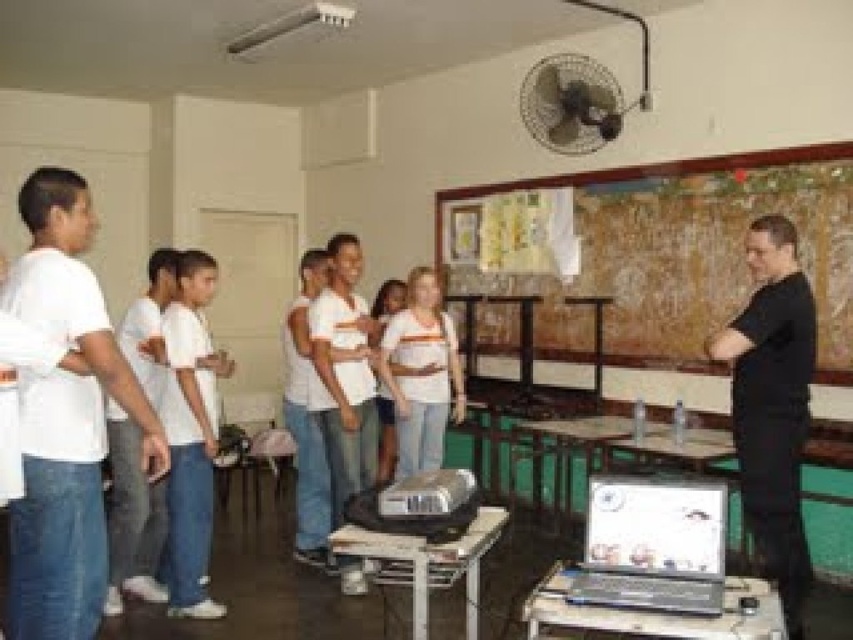
Question: Which object appears farthest from the camera in this image?

Choices:
 (A) black matte shirt at right
 (B) metallic silver fan at upper center

Answer: (B)

Question: Does white matte shirt at center appear under metallic silver fan at upper center?

Choices:
 (A) no
 (B) yes

Answer: (B)

Question: Is black matte shirt at right positioned behind white matte shirt at center?

Choices:
 (A) yes
 (B) no

Answer: (B)

Question: Which is farther from the white cotton shirt at left?

Choices:
 (A) white matte shirt at center
 (B) metallic silver fan at upper center
 (C) black matte shirt at right

Answer: (B)

Question: Does white matte shirt at center have a lesser width compared to metallic silver fan at upper center?

Choices:
 (A) yes
 (B) no

Answer: (A)

Question: Estimate the real-world distances between objects in this image. Which object is farther from the metallic silver fan at upper center?

Choices:
 (A) white cotton shirt at left
 (B) white matte shirt at center
 (C) black matte shirt at right

Answer: (A)